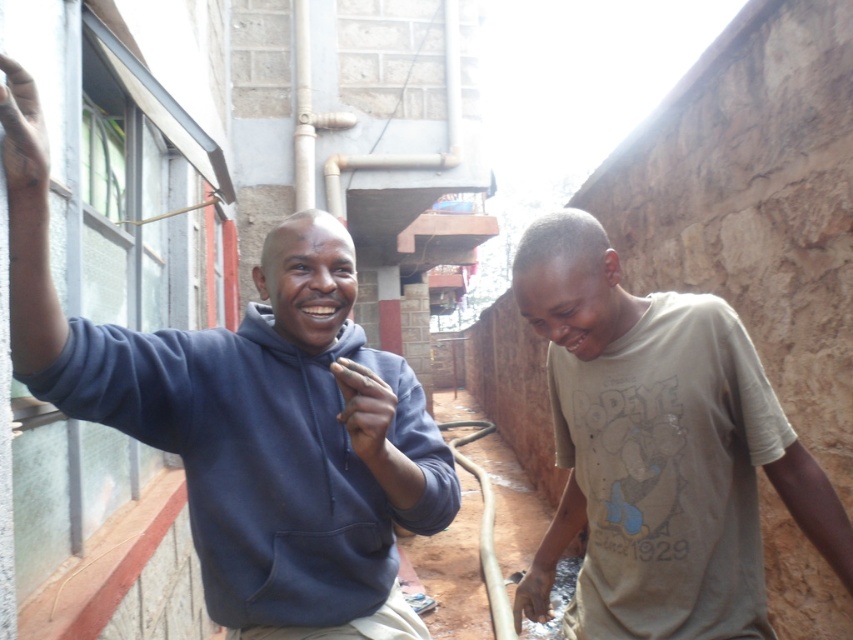
Based on the photo, between dark blue hoodie at left and light brown cotton shirt at lower right, which one has more height?

light brown cotton shirt at lower right

Consider the image. Is dark blue hoodie at left smaller than light brown cotton shirt at lower right?

Yes.

Does point (357, 289) lie behind point (576, 598)?

Yes, it is behind point (576, 598).

Where is `dark blue hoodie at left`? This screenshot has width=853, height=640. dark blue hoodie at left is located at coordinates (247, 413).